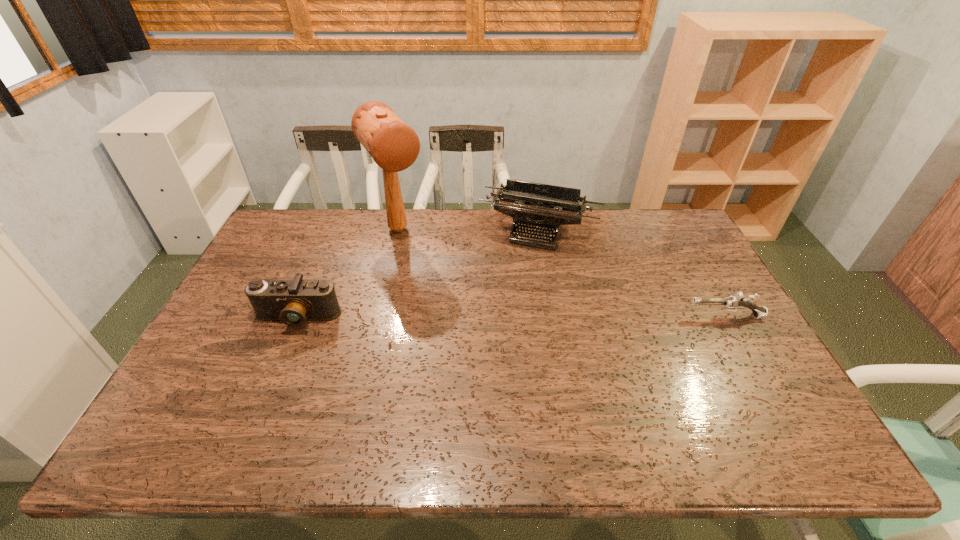
Where is `the third tallest object`? The width and height of the screenshot is (960, 540). the third tallest object is located at coordinates (292, 302).

The width and height of the screenshot is (960, 540). I want to click on gun, so click(x=732, y=303).

The width and height of the screenshot is (960, 540). What are the coordinates of `the shortest object` in the screenshot? It's located at (732, 303).

This screenshot has width=960, height=540. In order to click on typewriter in this screenshot , I will do `click(530, 204)`.

Where is `the third object from left to right`? Image resolution: width=960 pixels, height=540 pixels. the third object from left to right is located at coordinates [530, 204].

Where is `the tallest object`? This screenshot has width=960, height=540. the tallest object is located at coordinates (394, 146).

This screenshot has height=540, width=960. What are the coordinates of `free location located 0.140m on the lens of the third tallest object` in the screenshot? It's located at (273, 376).

You are a GUI agent. You are given a task and a screenshot of the screen. Output one action in this format:
    pyautogui.click(x=<x>, y=<y>)
    Task: Click on the free space located 0.190m aimed along the barrel of the rightmost object
    
    Given the screenshot: What is the action you would take?
    pyautogui.click(x=620, y=316)

The width and height of the screenshot is (960, 540). What are the coordinates of `vacant space located aimed along the barrel of the rightmost object` in the screenshot? It's located at (603, 316).

Where is `free space located 0.330m aimed along the barrel of the rightmost object`? free space located 0.330m aimed along the barrel of the rightmost object is located at coordinates (571, 316).